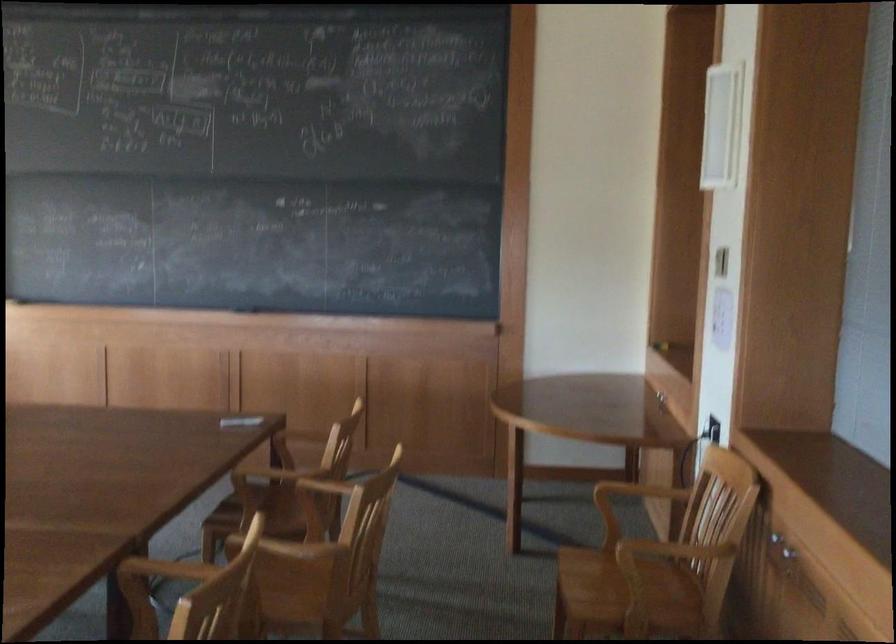
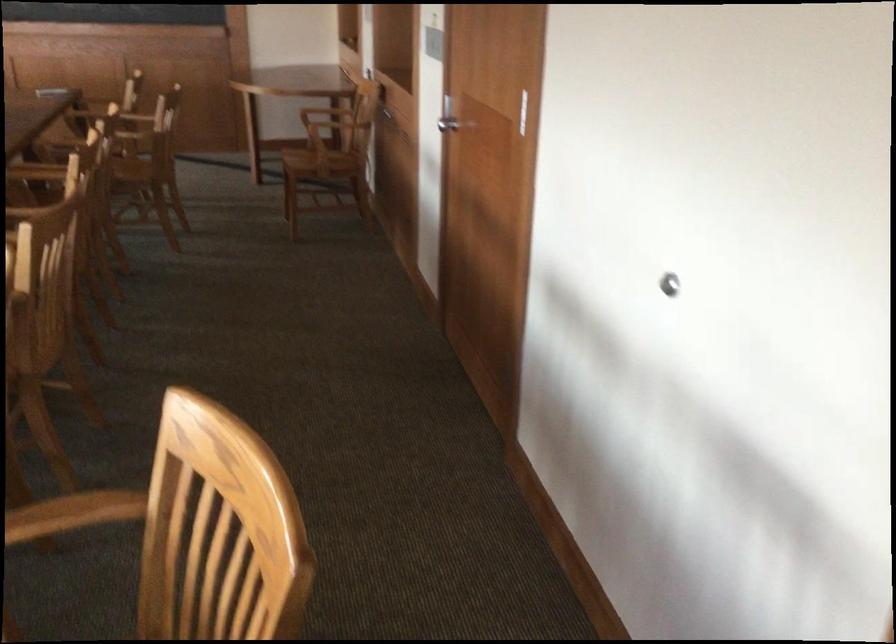
Question: I am providing you with two images of the same scene from different viewpoints. Which of the following objects are not visible in image2?

Choices:
 (A) silver cabinet knob
 (B) chair sitting surface
 (C) silver door handle
 (D) white paper bin

Answer: (A)